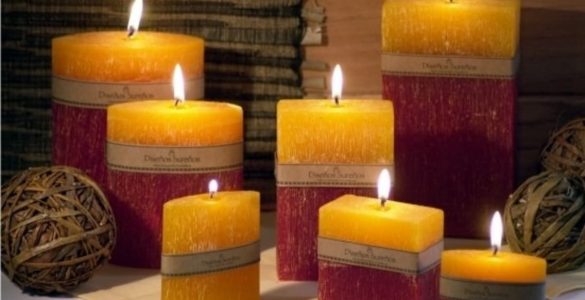
The image size is (585, 300). Find the location of `candles`. candles is located at coordinates (464, 268), (443, 127), (364, 242), (329, 153), (211, 230), (137, 143), (88, 74).